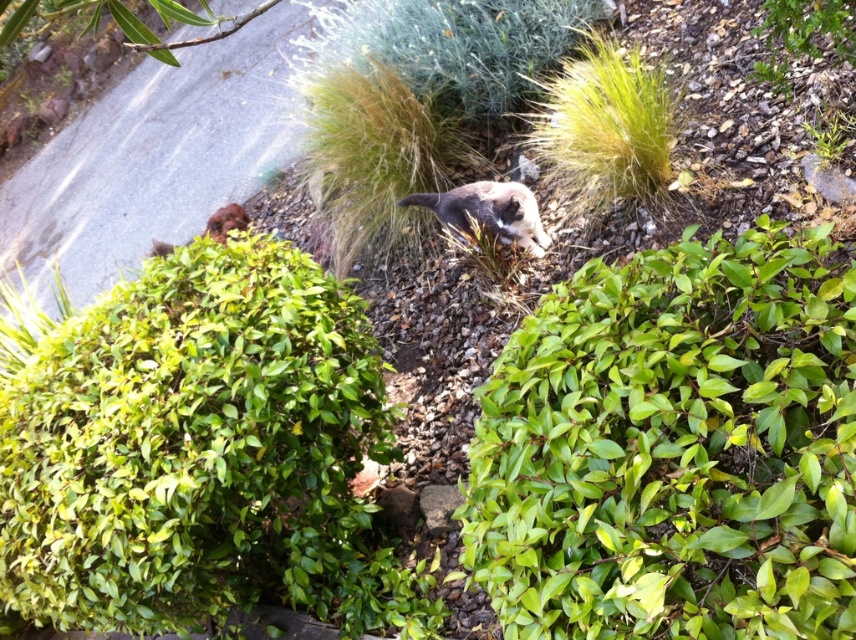
Question: Is the position of green leafy hedge at center more distant than that of green fuzzy bush at upper center?

Choices:
 (A) yes
 (B) no

Answer: (B)

Question: Estimate the real-world distances between objects in this image. Which object is farther from the green leafy hedge at center?

Choices:
 (A) green leafy shrub at center
 (B) green fuzzy bush at upper center
 (C) fuzzy gray cat at center

Answer: (B)

Question: Is green leafy shrub at center smaller than green fuzzy bush at upper center?

Choices:
 (A) yes
 (B) no

Answer: (A)

Question: Which is farther from the fuzzy gray cat at center?

Choices:
 (A) green leafy hedge at center
 (B) green leafy shrub at center
 (C) green fuzzy bush at upper center

Answer: (B)

Question: Which point is farther to the camera?

Choices:
 (A) (762, 380)
 (B) (575, 24)

Answer: (B)

Question: Does green fuzzy bush at upper center have a lesser width compared to fuzzy gray cat at center?

Choices:
 (A) no
 (B) yes

Answer: (A)